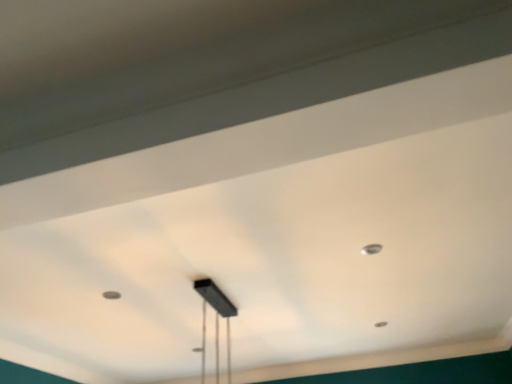
Question: Is black matte rectangular light fixture at center inside the boundaries of metallic silver dot at upper right, or outside?

Choices:
 (A) inside
 (B) outside

Answer: (B)

Question: In terms of height, does black matte rectangular light fixture at center look taller or shorter compared to metallic silver dot at upper right?

Choices:
 (A) tall
 (B) short

Answer: (A)

Question: Relative to metallic silver dot at upper right, is black matte rectangular light fixture at center in front or behind?

Choices:
 (A) front
 (B) behind

Answer: (A)

Question: Is metallic silver dot at upper right inside the boundaries of black matte rectangular light fixture at center, or outside?

Choices:
 (A) outside
 (B) inside

Answer: (A)

Question: From a real-world perspective, is metallic silver dot at upper right above or below black matte rectangular light fixture at center?

Choices:
 (A) below
 (B) above

Answer: (B)

Question: Is metallic silver dot at upper right to the left or to the right of black matte rectangular light fixture at center in the image?

Choices:
 (A) left
 (B) right

Answer: (B)

Question: Is metallic silver dot at upper right wider or thinner than black matte rectangular light fixture at center?

Choices:
 (A) thin
 (B) wide

Answer: (A)